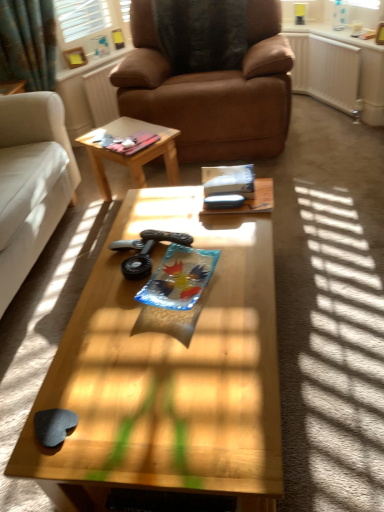
Question: Are brown leather radiator at upper center, the 2th radiator in the right-to-left sequence, and white plastic radiator at upper right, placed as the first radiator when sorted from right to left, far apart?

Choices:
 (A) yes
 (B) no

Answer: (A)

Question: Considering the relative sizes of brown leather radiator at upper center, the 2th radiator in the right-to-left sequence, and white plastic radiator at upper right, arranged as the second radiator when viewed from the left, in the image provided, is brown leather radiator at upper center, the 2th radiator in the right-to-left sequence, bigger than white plastic radiator at upper right, arranged as the second radiator when viewed from the left,?

Choices:
 (A) yes
 (B) no

Answer: (B)

Question: Does brown leather radiator at upper center, the 2th radiator in the right-to-left sequence, come in front of white plastic radiator at upper right, placed as the first radiator when sorted from right to left?

Choices:
 (A) yes
 (B) no

Answer: (B)

Question: From a real-world perspective, is brown leather radiator at upper center, the 2th radiator in the right-to-left sequence, physically above white plastic radiator at upper right, arranged as the second radiator when viewed from the left?

Choices:
 (A) yes
 (B) no

Answer: (A)

Question: Does brown leather radiator at upper center, the 2th radiator in the right-to-left sequence, have a lesser width compared to white plastic radiator at upper right, placed as the first radiator when sorted from right to left?

Choices:
 (A) no
 (B) yes

Answer: (B)

Question: Is point tap(84, 374) closer or farther from the camera than point tap(102, 81)?

Choices:
 (A) farther
 (B) closer

Answer: (B)

Question: Choose the correct answer: Is wooden coffee table at center, acting as the 2th coffee table starting from the top, inside brown leather radiator at upper center, acting as the first radiator starting from the left, or outside it?

Choices:
 (A) inside
 (B) outside

Answer: (B)

Question: In the image, is wooden coffee table at center, which appears as the first coffee table when ordered from the bottom, positioned in front of or behind brown leather radiator at upper center, acting as the first radiator starting from the left?

Choices:
 (A) behind
 (B) front

Answer: (B)

Question: From the image's perspective, is wooden coffee table at center, acting as the 2th coffee table starting from the top, above or below brown leather radiator at upper center, the 2th radiator in the right-to-left sequence?

Choices:
 (A) below
 (B) above

Answer: (A)

Question: Is white plastic radiator at upper right, arranged as the second radiator when viewed from the left, taller or shorter than wooden at center, the 2th coffee table from the front?

Choices:
 (A) short
 (B) tall

Answer: (B)

Question: Is point (309, 94) closer or farther from the camera than point (163, 160)?

Choices:
 (A) closer
 (B) farther

Answer: (B)

Question: Based on their positions, is white plastic radiator at upper right, placed as the first radiator when sorted from right to left, located to the left or right of wooden at center, acting as the first coffee table starting from the back?

Choices:
 (A) left
 (B) right

Answer: (B)

Question: From the image's perspective, is white plastic radiator at upper right, arranged as the second radiator when viewed from the left, positioned above or below wooden at center, the 2th coffee table from the front?

Choices:
 (A) below
 (B) above

Answer: (B)

Question: Is brown leather chair at center taller or shorter than brown leather radiator at upper center, the 2th radiator in the right-to-left sequence?

Choices:
 (A) tall
 (B) short

Answer: (A)

Question: Is brown leather chair at center to the left or to the right of brown leather radiator at upper center, acting as the first radiator starting from the left, in the image?

Choices:
 (A) right
 (B) left

Answer: (A)